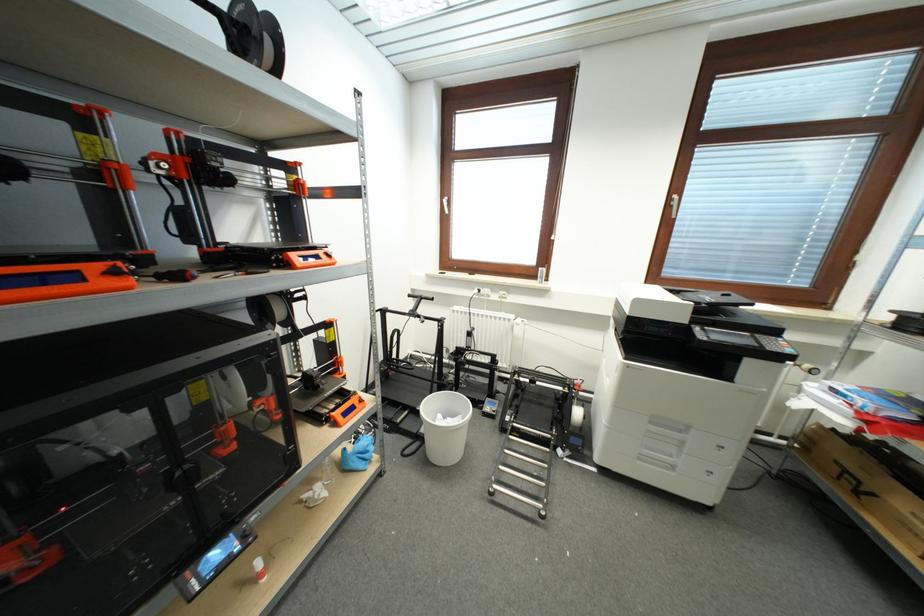
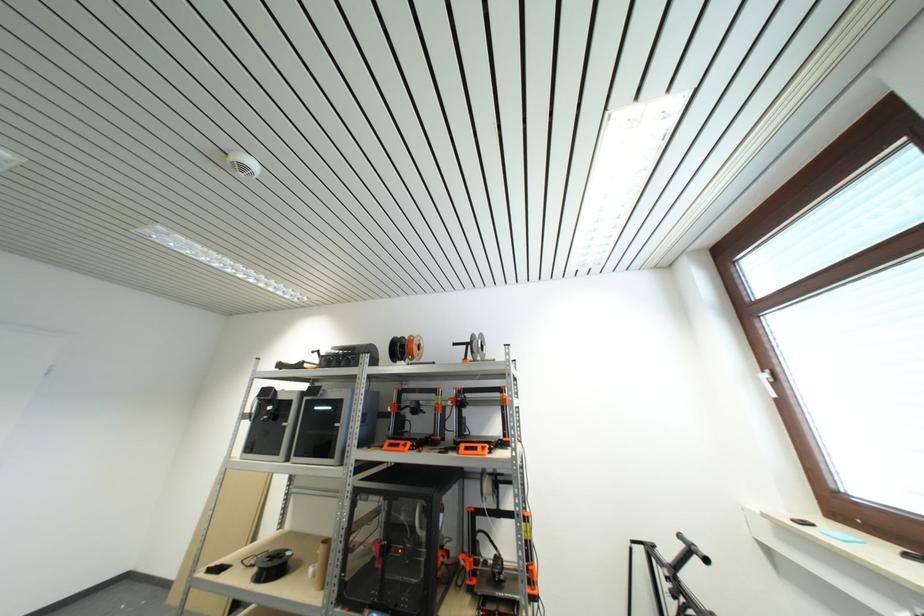
Where in the second image is the point corresponding to point 415,299 from the first image?

(685, 540)